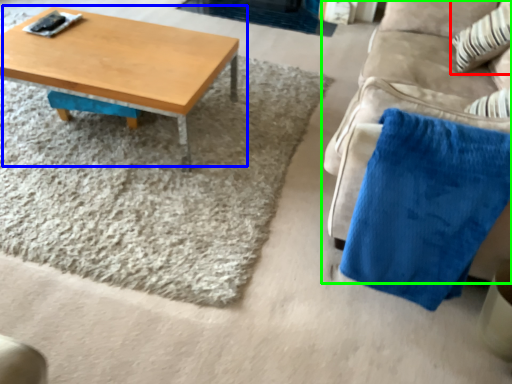
Question: Which object is positioned farthest from throw pillow (highlighted by a red box)? Select from coffee table (highlighted by a blue box) and studio couch (highlighted by a green box).

Choices:
 (A) coffee table
 (B) studio couch

Answer: (A)